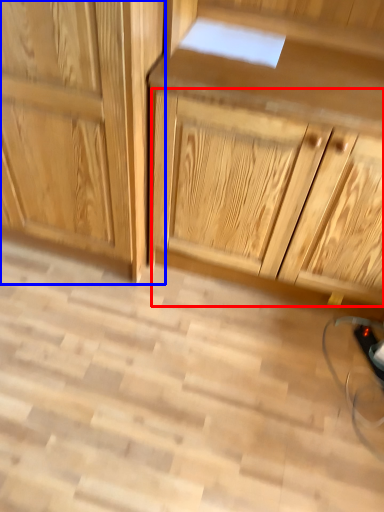
Question: Which point is further to the camera, drawer (highlighted by a red box) or cabinetry (highlighted by a blue box)?

Choices:
 (A) drawer
 (B) cabinetry

Answer: (B)